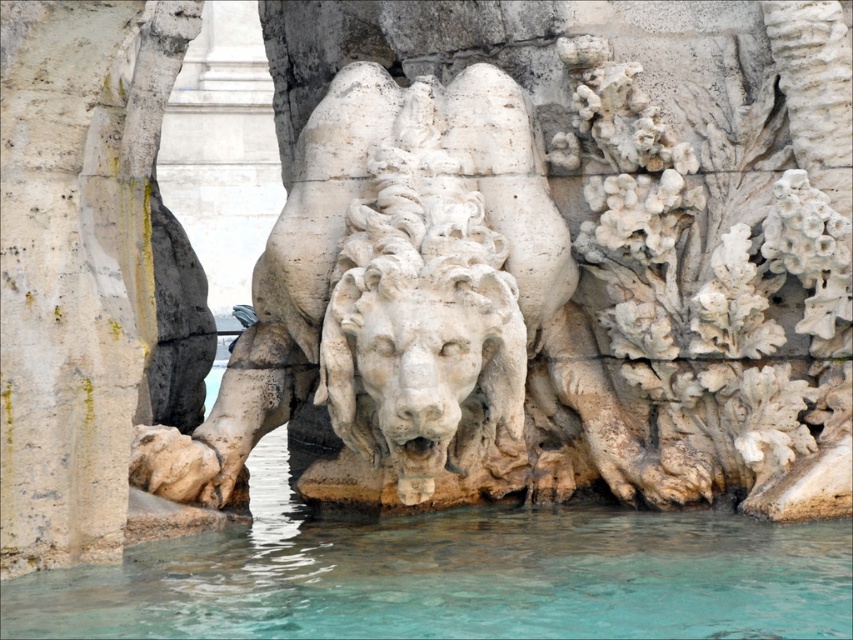
Between point (296, 628) and point (91, 442), which one is positioned behind?

The point (91, 442) is behind.

Does clear water at lower center have a lesser height compared to white stone pillar at left?

Yes, clear water at lower center is shorter than white stone pillar at left.

What do you see at coordinates (456, 579) in the screenshot? I see `clear water at lower center` at bounding box center [456, 579].

Locate an element on the screen. clear water at lower center is located at coordinates (456, 579).